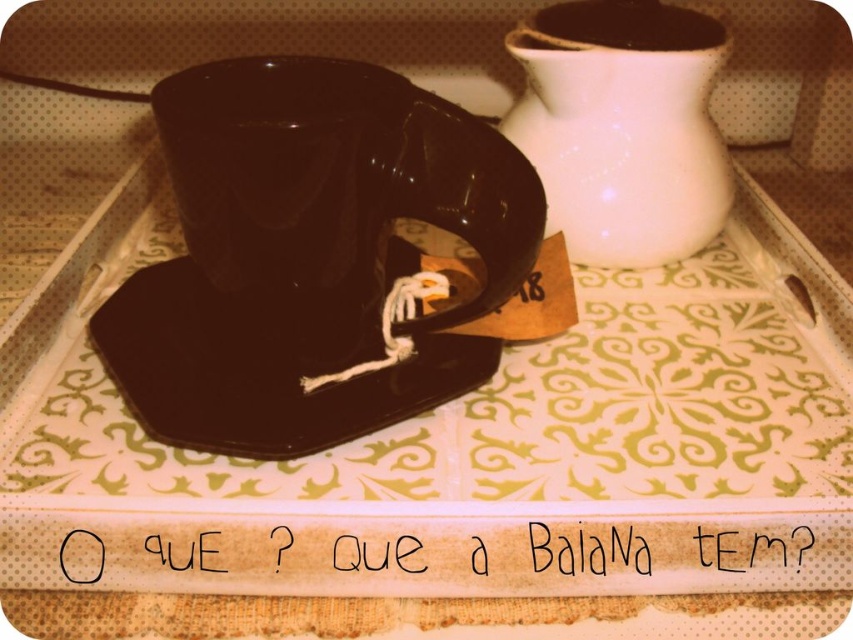
You are setting up a tea service and need to place the white glossy jug at upper right on the glossy ceramic saucer at center. Can you do this without moving the saucer?

The glossy ceramic saucer at center is positioned under the white glossy jug at upper right, so yes, you can place the white glossy jug at upper right on the glossy ceramic saucer at center without moving it.

From the picture: You are arranging items on a tray and need to know the spatial relationship between the white glossy jug at upper right and the glossy ceramic coffee cup at upper center. Which item is closer to you when looking at the tray?

The white glossy jug at upper right is closer to you because it is in front of the glossy ceramic coffee cup at upper center.

You are placing a small decorative item between the glossy ceramic saucer at center and the white glossy jug at upper right. Can you fit it there without touching either object?

The distance between the glossy ceramic saucer at center and the white glossy jug at upper right is 12.30 inches. Since the item is small, it can be placed in the space between them without touching either object.